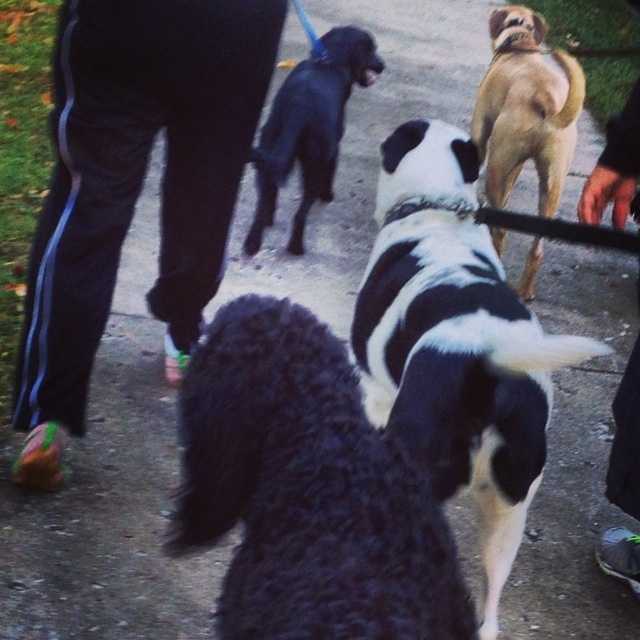
Question: Is fluffy black dog at center to the left of black fabric pants at lower right from the viewer's perspective?

Choices:
 (A) yes
 (B) no

Answer: (A)

Question: Which point appears farthest from the camera in this image?

Choices:
 (A) (477, 97)
 (B) (51, 218)
 (C) (604, 532)

Answer: (A)

Question: Which of the following is the closest to the observer?

Choices:
 (A) black fabric pants at lower right
 (B) tan smooth coat dog at upper right
 (C) black track pants at center

Answer: (C)

Question: Does black and white fur at center have a smaller size compared to shiny black dog at center?

Choices:
 (A) yes
 (B) no

Answer: (A)

Question: Can you confirm if fluffy black dog at center is bigger than shiny black dog at center?

Choices:
 (A) no
 (B) yes

Answer: (A)

Question: Among these points, which one is farthest from the camera?

Choices:
 (A) (230, 150)
 (B) (184, 400)

Answer: (A)